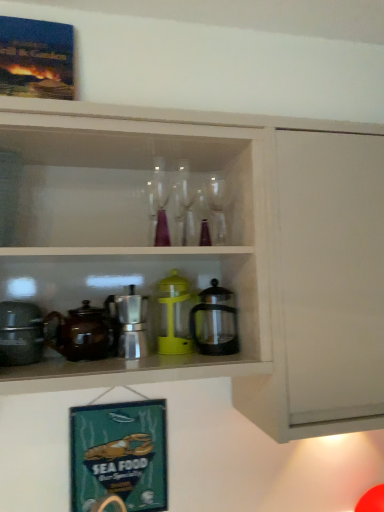
Question: From the image's perspective, does wooden picture frame at upper left, which is counted as the 2th picture frame, starting from the bottom, appear higher than clear glass wine glass at center, which is counted as the 2th wine glass, starting from the right?

Choices:
 (A) no
 (B) yes

Answer: (B)

Question: Does wooden picture frame at upper left, the first picture frame from the front, have a smaller size compared to clear glass wine glass at center, positioned as the first wine glass in left-to-right order?

Choices:
 (A) no
 (B) yes

Answer: (A)

Question: Does wooden picture frame at upper left, the first picture frame from the front, turn towards clear glass wine glass at center, positioned as the first wine glass in left-to-right order?

Choices:
 (A) yes
 (B) no

Answer: (B)

Question: Does wooden picture frame at upper left, which is the second picture frame in back-to-front order, have a larger size compared to clear glass wine glass at center, which is counted as the 2th wine glass, starting from the right?

Choices:
 (A) no
 (B) yes

Answer: (B)

Question: Is wooden picture frame at upper left, which is the second picture frame in back-to-front order, not near clear glass wine glass at center, positioned as the first wine glass in left-to-right order?

Choices:
 (A) no
 (B) yes

Answer: (A)

Question: From a real-world perspective, is matte black pot at left, the second appliance when ordered from right to left, physically located above or below yellow plastic container at center, which is the 2th appliance from left to right?

Choices:
 (A) below
 (B) above

Answer: (A)

Question: Is matte black pot at left, the second appliance when ordered from right to left, taller or shorter than yellow plastic container at center, the first appliance from the right?

Choices:
 (A) short
 (B) tall

Answer: (A)

Question: From the image's perspective, is matte black pot at left, the second appliance when ordered from right to left, located above or below yellow plastic container at center, the first appliance from the right?

Choices:
 (A) below
 (B) above

Answer: (A)

Question: Is point (13, 362) closer or farther from the camera than point (187, 292)?

Choices:
 (A) closer
 (B) farther

Answer: (A)

Question: From a real-world perspective, is matte white cabinet at upper center above or below metallic silver coffee pot at center, which is the 1th coffeepot in left-to-right order?

Choices:
 (A) below
 (B) above

Answer: (B)

Question: Is point (380, 172) positioned closer to the camera than point (77, 330)?

Choices:
 (A) farther
 (B) closer

Answer: (A)

Question: Considering the positions of matte white cabinet at upper center and metallic silver coffee pot at center, which is the 1th coffeepot in left-to-right order, in the image, is matte white cabinet at upper center wider or thinner than metallic silver coffee pot at center, which is the 1th coffeepot in left-to-right order,?

Choices:
 (A) thin
 (B) wide

Answer: (B)

Question: Looking at the image, does matte white cabinet at upper center seem bigger or smaller compared to metallic silver coffee pot at center, arranged as the 2th coffeepot when viewed from the right?

Choices:
 (A) small
 (B) big

Answer: (B)

Question: Is green fabric signboard at lower left, placed as the 1th picture frame when sorted from bottom to top, wider or thinner than clear glass wine glass at center, which is counted as the 2th wine glass, starting from the right?

Choices:
 (A) thin
 (B) wide

Answer: (A)

Question: Relative to clear glass wine glass at center, positioned as the first wine glass in left-to-right order, is green fabric signboard at lower left, the second picture frame positioned from the front, in front or behind?

Choices:
 (A) behind
 (B) front

Answer: (A)